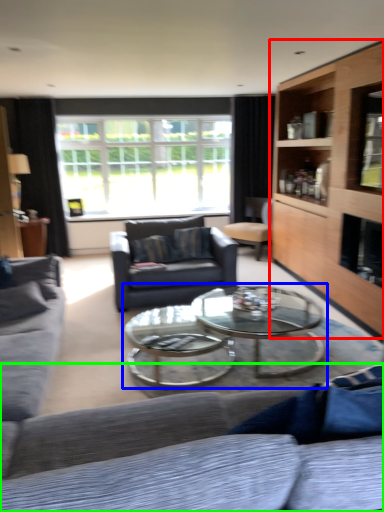
Question: Which is farther away from cabinetry (highlighted by a red box)? coffee table (highlighted by a blue box) or studio couch (highlighted by a green box)?

Choices:
 (A) coffee table
 (B) studio couch

Answer: (B)